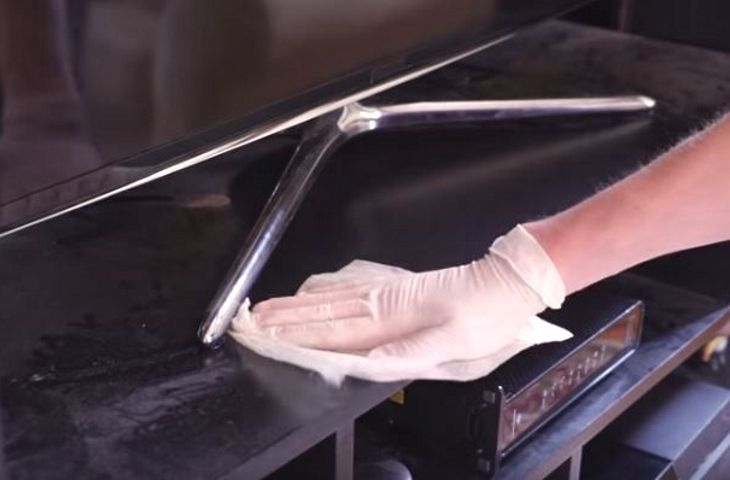
The height and width of the screenshot is (480, 730). Find the location of `stand`. stand is located at coordinates (361, 116).